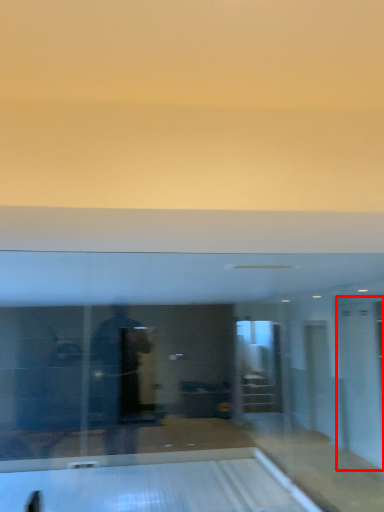
Question: From the image's perspective, what is the correct spatial relationship of glass door (annotated by the red box) in relation to bowling alley?

Choices:
 (A) above
 (B) below

Answer: (A)